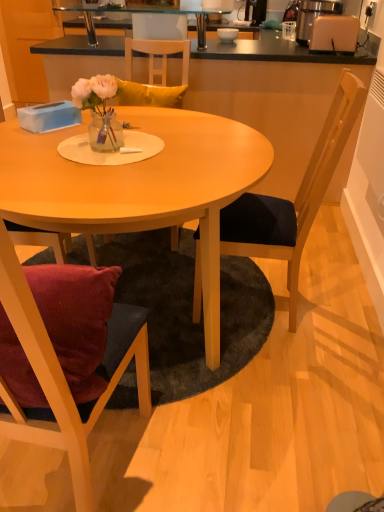
What are the coordinates of `space that is in front of translucent glass vase at center` in the screenshot? It's located at (94, 165).